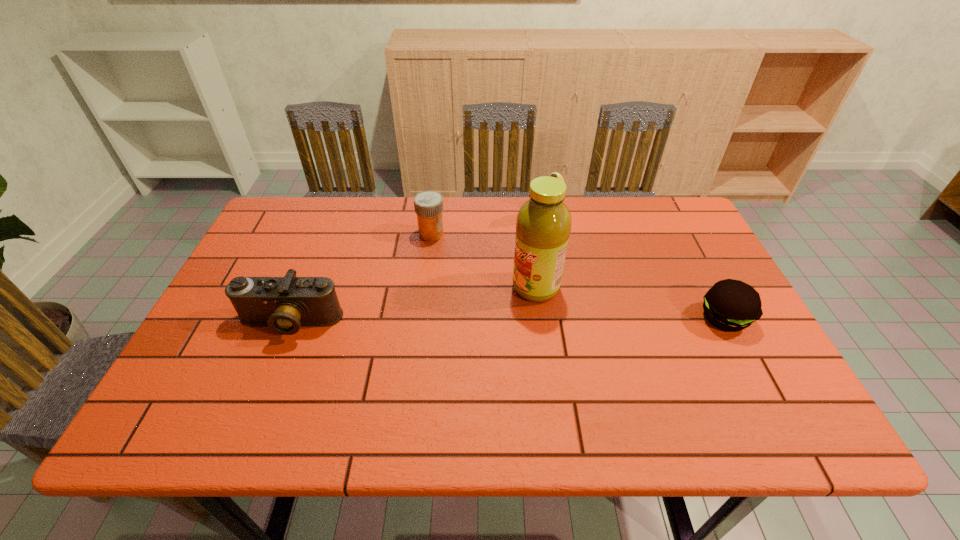
This screenshot has width=960, height=540. What are the coordinates of `vacant space on the desktop that is between the camera and the patty and is positioned from the stem of the fourth shortest object` in the screenshot? It's located at [x=478, y=320].

This screenshot has height=540, width=960. I want to click on free space on the desktop that is between the leftmost object and the shortest object and is positioned on the front label of the tallest object, so click(x=470, y=321).

What are the coordinates of `vacant spot on the desktop that is between the leftmost object and the patty and is positioned on the label side of the medicine` in the screenshot? It's located at (541, 320).